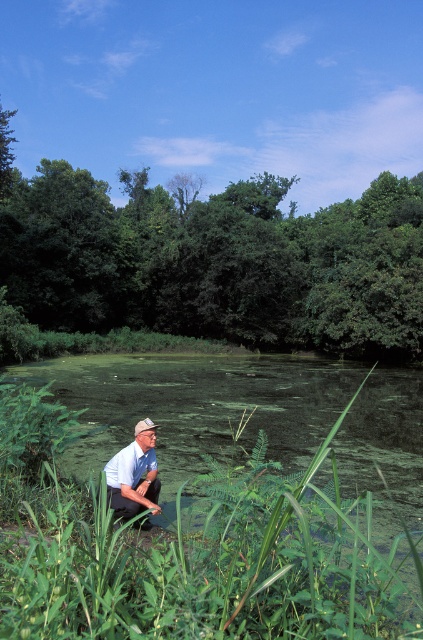
You are standing at the point marked as point [214,259] in the image. What object is directly in front of you?

The point [214,259] corresponds to the green leafy tree at center, so the green leafy tree at center is directly in front of you.

You are standing at the edge of the pond and want to take a photo of the green leafy tree at center. If your camera has a maximum zoom range of 100 feet, will you be able to capture the tree clearly without moving closer?

The green leafy tree at center is 115.56 feet away from the camera. Since the camera can only zoom up to 100 feet, you won want to move closer to ensure the tree is captured clearly.

You are a photographer trying to capture the green leafy tree at center and the light blue shirt at lower center in the same frame. Can you see both objects clearly at the same time?

The light blue shirt at lower center is behind the green leafy tree at center, so the tree may block the view of the shirt, making it difficult to see both clearly in the same frame.